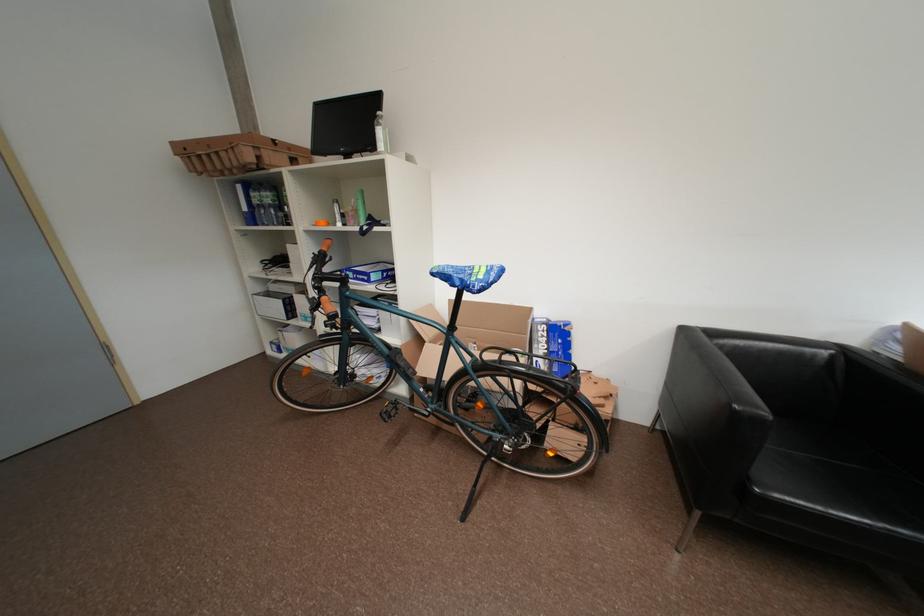
This screenshot has width=924, height=616. Describe the element at coordinates (390, 410) in the screenshot. I see `a black bicycle pedal` at that location.